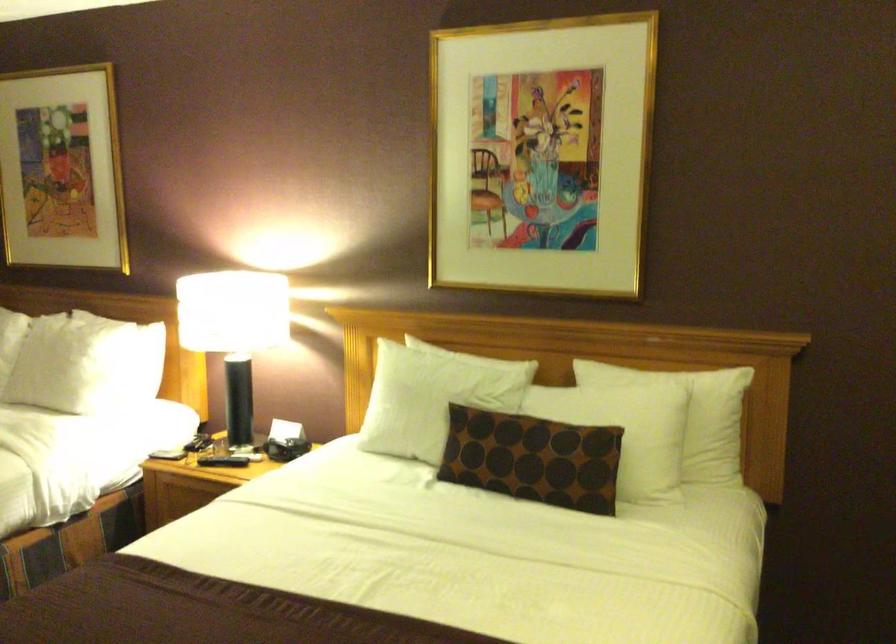
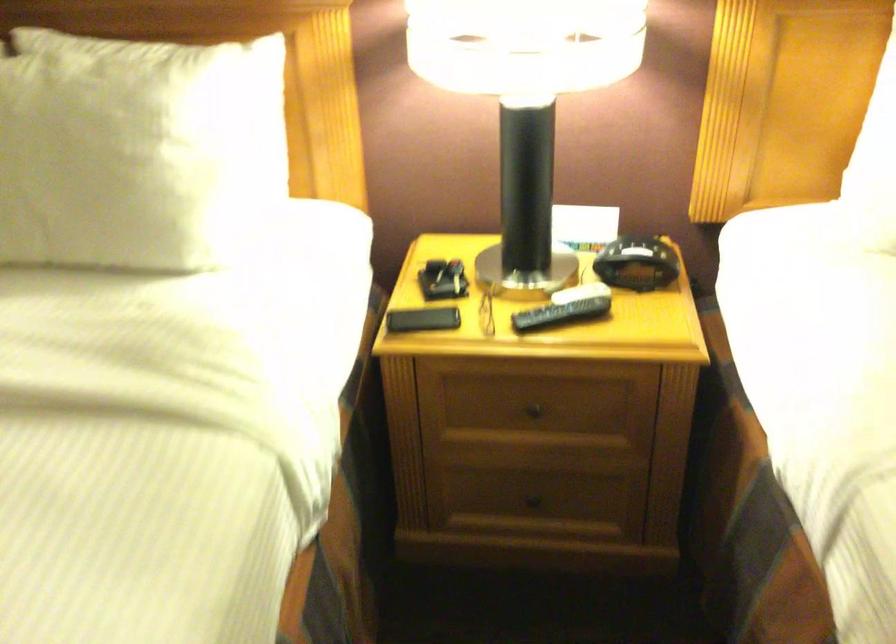
Find the pixel in the second image that matches [248,459] in the first image.

(579, 292)